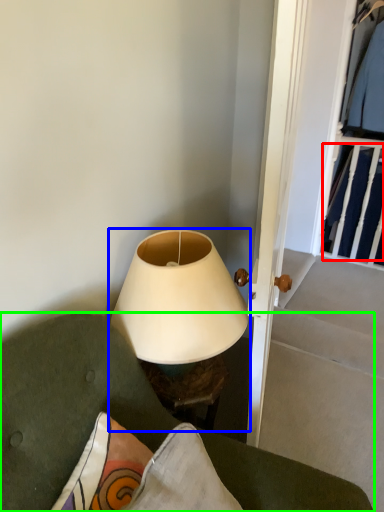
Question: Considering the real-world distances, which object is farthest from clothing (highlighted by a red box)? lamp (highlighted by a blue box) or furniture (highlighted by a green box)?

Choices:
 (A) lamp
 (B) furniture

Answer: (B)